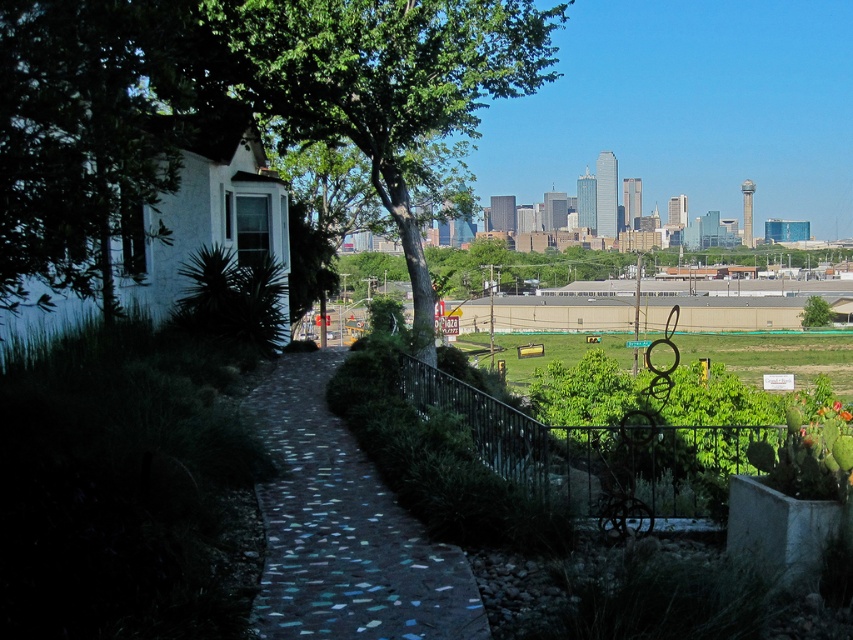
Question: Which object is positioned farthest from the green leafy tree at center?

Choices:
 (A) mosaic stone path at center
 (B) green leafy tree at upper center

Answer: (B)

Question: Which object appears farthest from the camera in this image?

Choices:
 (A) mosaic stone path at center
 (B) green leafy tree at upper center
 (C) green leafy tree at center

Answer: (B)

Question: Which point is farther from the camera taking this photo?

Choices:
 (A) (415, 38)
 (B) (813, 324)

Answer: (B)

Question: Is green leafy tree at center to the right of mosaic stone path at center from the viewer's perspective?

Choices:
 (A) yes
 (B) no

Answer: (B)

Question: Is green leafy tree at center positioned in front of mosaic stone path at center?

Choices:
 (A) yes
 (B) no

Answer: (B)

Question: Is green leafy tree at center closer to camera compared to green leafy tree at upper center?

Choices:
 (A) no
 (B) yes

Answer: (B)